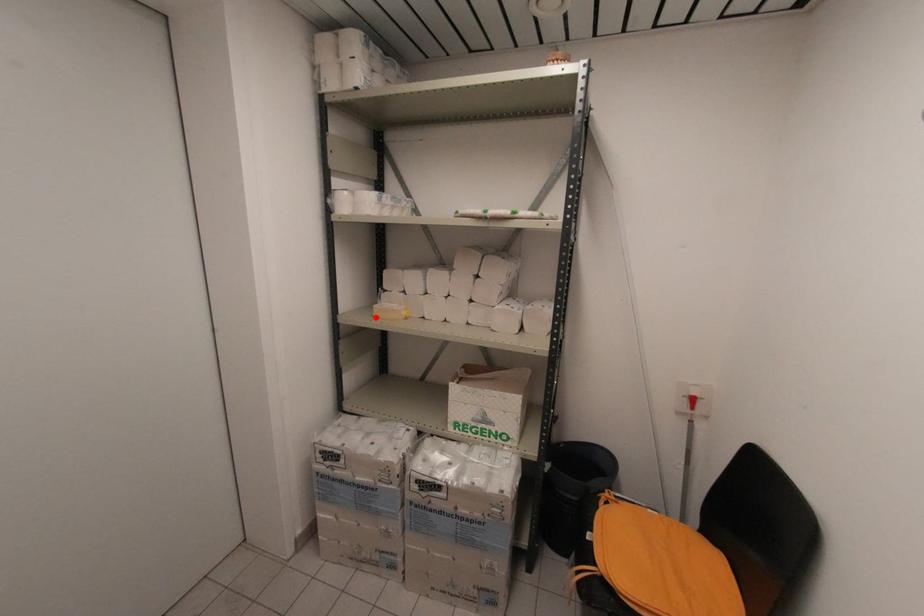
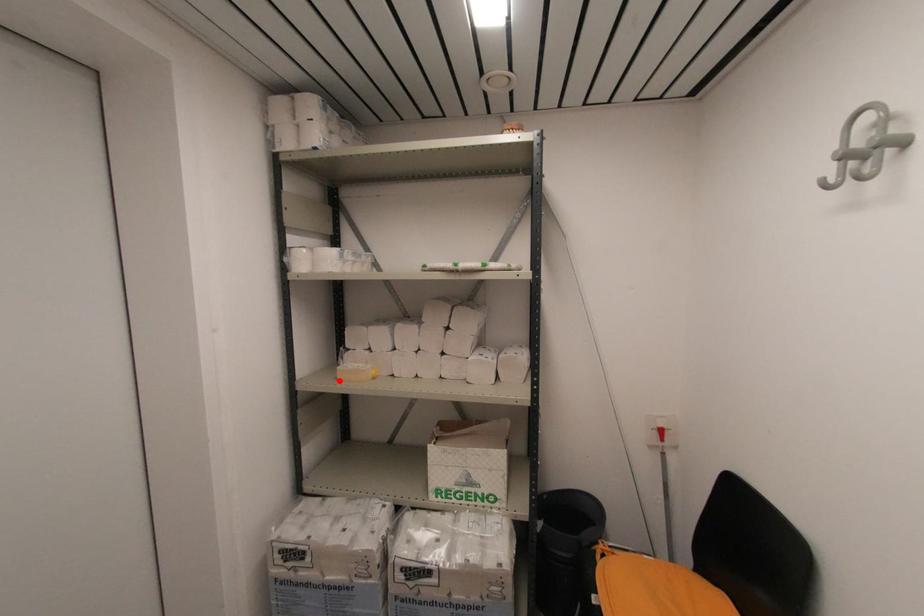
I am providing you with two images of the same scene from different viewpoints. A red point is marked on the first image and another point is marked on the second image. Is the marked point in image1 the same physical position as the marked point in image2?

Yes